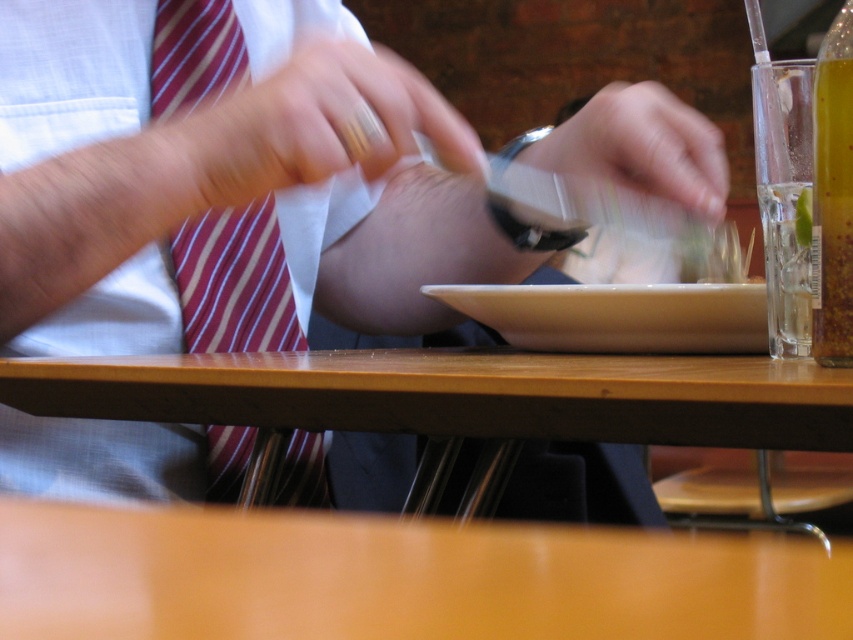
You are a waiter in a restaurant and need to deliver a drink to the table. The customer is seated at the table shown in the scene. There is a point marked at coordinates (x=167, y=99) on the table. If you place the drink exactly at this point, how far will it be from the customer?

The point at coordinates (x=167, y=99) is 25.01 inches away from the viewer, so placing the drink there would mean it is 25.01 inches away from the customer.